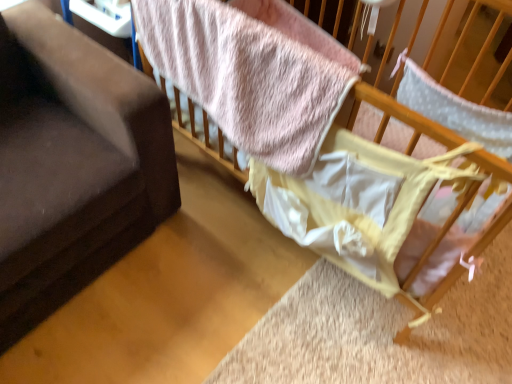
Question: Considering the relative sizes of dark gray fabric couch at left and pink fuzzy blanket at upper center in the image provided, is dark gray fabric couch at left bigger than pink fuzzy blanket at upper center?

Choices:
 (A) yes
 (B) no

Answer: (A)

Question: Is dark gray fabric couch at left thinner than pink fuzzy blanket at upper center?

Choices:
 (A) yes
 (B) no

Answer: (B)

Question: Does dark gray fabric couch at left have a greater height compared to pink fuzzy blanket at upper center?

Choices:
 (A) no
 (B) yes

Answer: (B)

Question: Is dark gray fabric couch at left behind pink fuzzy blanket at upper center?

Choices:
 (A) no
 (B) yes

Answer: (A)

Question: Is dark gray fabric couch at left located outside pink fuzzy blanket at upper center?

Choices:
 (A) yes
 (B) no

Answer: (A)

Question: Would you say pink fuzzy blanket at upper center is to the left or to the right of dark gray fabric couch at left in the picture?

Choices:
 (A) right
 (B) left

Answer: (A)

Question: Is pink fuzzy blanket at upper center bigger or smaller than dark gray fabric couch at left?

Choices:
 (A) small
 (B) big

Answer: (A)

Question: Looking at their shapes, would you say pink fuzzy blanket at upper center is wider or thinner than dark gray fabric couch at left?

Choices:
 (A) wide
 (B) thin

Answer: (B)

Question: Considering their positions, is pink fuzzy blanket at upper center located in front of or behind dark gray fabric couch at left?

Choices:
 (A) front
 (B) behind

Answer: (B)

Question: From the image's perspective, is pink fuzzy blanket at upper center above or below soft pink fabric at upper right?

Choices:
 (A) above
 (B) below

Answer: (A)

Question: Is pink fuzzy blanket at upper center inside the boundaries of soft pink fabric at upper right, or outside?

Choices:
 (A) inside
 (B) outside

Answer: (A)

Question: Is pink fuzzy blanket at upper center in front of or behind soft pink fabric at upper right in the image?

Choices:
 (A) behind
 (B) front

Answer: (A)

Question: In the image, is pink fuzzy blanket at upper center on the left side or the right side of soft pink fabric at upper right?

Choices:
 (A) right
 (B) left

Answer: (B)

Question: Considering their positions, is soft pink fabric at upper right located in front of or behind dark gray fabric couch at left?

Choices:
 (A) front
 (B) behind

Answer: (B)

Question: Considering the positions of soft pink fabric at upper right and dark gray fabric couch at left in the image, is soft pink fabric at upper right bigger or smaller than dark gray fabric couch at left?

Choices:
 (A) big
 (B) small

Answer: (A)